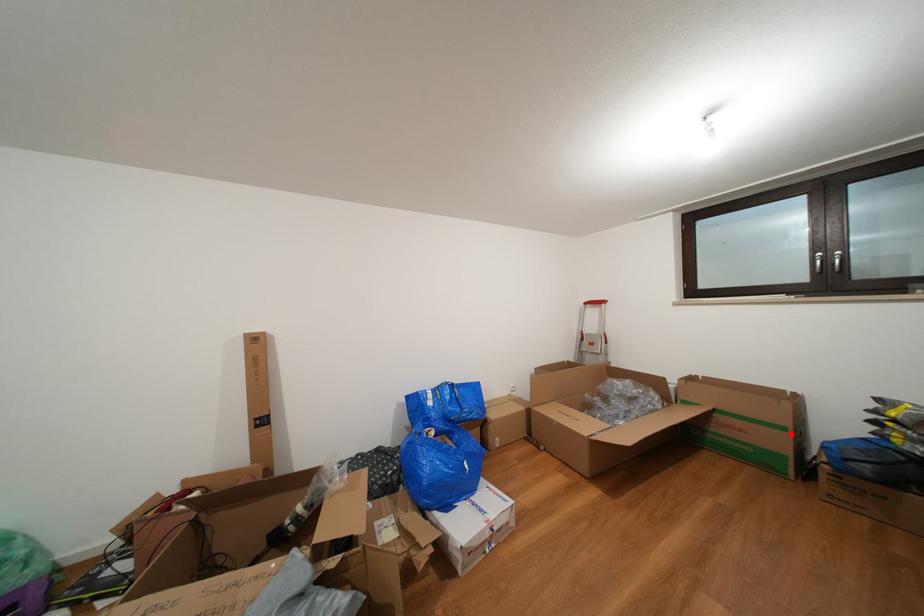
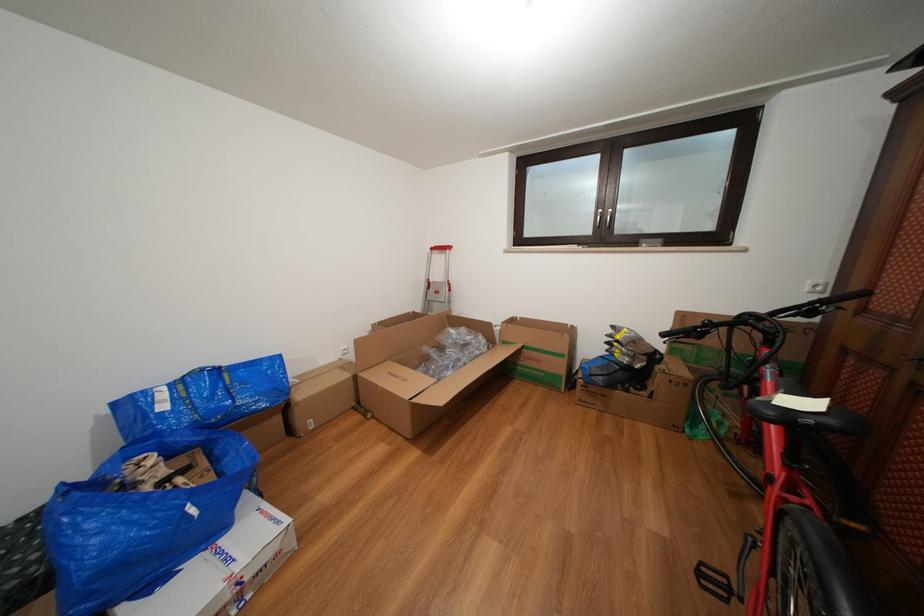
Find the pixel in the second image that matches the highlighted location in the first image.

(570, 361)